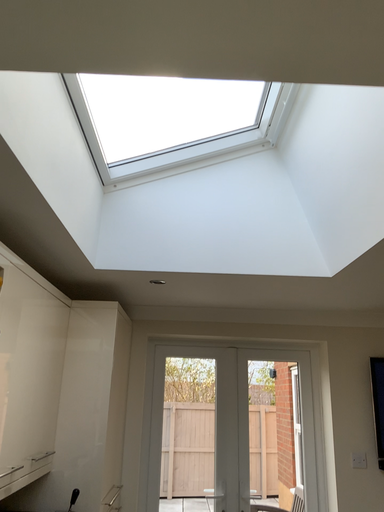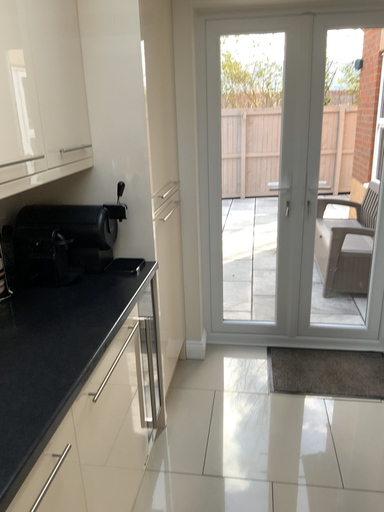
Question: How did the camera likely rotate when shooting the video?

Choices:
 (A) rotated upward
 (B) rotated downward

Answer: (B)